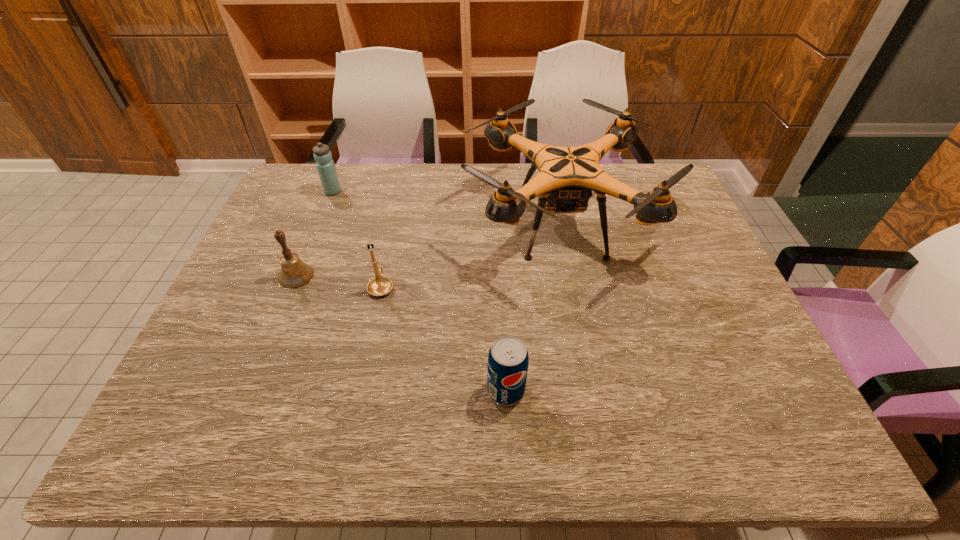
I want to click on object located in the far right corner section of the desktop, so click(x=567, y=176).

The height and width of the screenshot is (540, 960). What are the coordinates of `free space at the far edge of the desktop` in the screenshot? It's located at (387, 171).

You are a GUI agent. You are given a task and a screenshot of the screen. Output one action in this format:
    pyautogui.click(x=<x>, y=<y>)
    Task: Click on the vacant point at the near edge
    
    Given the screenshot: What is the action you would take?
    pyautogui.click(x=542, y=430)

The height and width of the screenshot is (540, 960). Identify the location of free space at the left edge of the desktop. (204, 399).

Identify the location of vacant space at the right edge of the desktop. The height and width of the screenshot is (540, 960). (730, 332).

This screenshot has height=540, width=960. Find the location of `vacant space at the far right corner of the desktop`. vacant space at the far right corner of the desktop is located at coordinates (660, 171).

Locate an element on the screen. The image size is (960, 540). free space between the water bottle and the candle holder is located at coordinates (357, 239).

Locate an element on the screen. The width and height of the screenshot is (960, 540). unoccupied position between the nearest object and the bell is located at coordinates (401, 333).

Identify the location of unoccupied area between the candle holder and the water bottle. The width and height of the screenshot is (960, 540). (357, 239).

Identify the location of vacant region between the candle holder and the tallest object. pos(470,255).